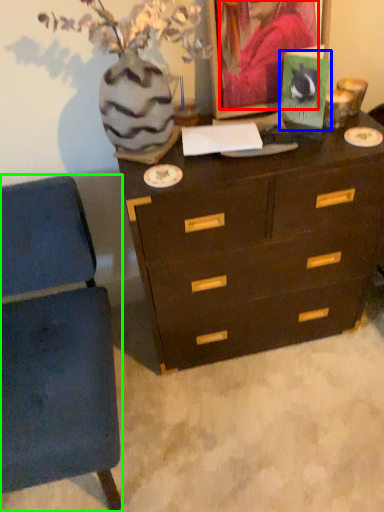
Question: Considering the real-world distances, which object is farthest from person (highlighted by a red box)? postcard (highlighted by a blue box) or furniture (highlighted by a green box)?

Choices:
 (A) postcard
 (B) furniture

Answer: (B)